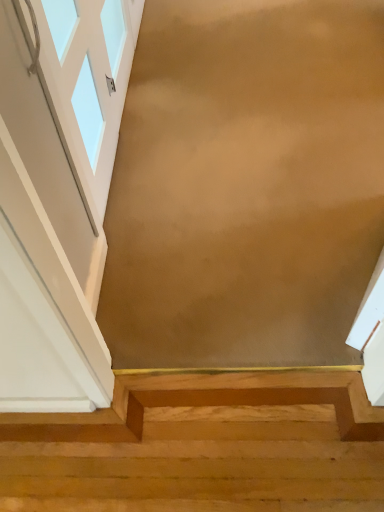
Question: Does point (84, 468) appear closer or farther from the camera than point (94, 60)?

Choices:
 (A) closer
 (B) farther

Answer: (A)

Question: Is light wood stairs at lower center taller or shorter than white glass window at upper left?

Choices:
 (A) short
 (B) tall

Answer: (A)

Question: Is light wood stairs at lower center situated inside white glass window at upper left or outside?

Choices:
 (A) inside
 (B) outside

Answer: (B)

Question: Considering their positions, is white glass window at upper left located in front of or behind light wood stairs at lower center?

Choices:
 (A) behind
 (B) front

Answer: (B)

Question: From the image's perspective, is white glass window at upper left positioned above or below light wood stairs at lower center?

Choices:
 (A) above
 (B) below

Answer: (A)

Question: Considering the positions of white glass window at upper left and light wood stairs at lower center in the image, is white glass window at upper left taller or shorter than light wood stairs at lower center?

Choices:
 (A) tall
 (B) short

Answer: (A)

Question: Would you say white glass window at upper left is to the left or to the right of light wood stairs at lower center in the picture?

Choices:
 (A) left
 (B) right

Answer: (A)